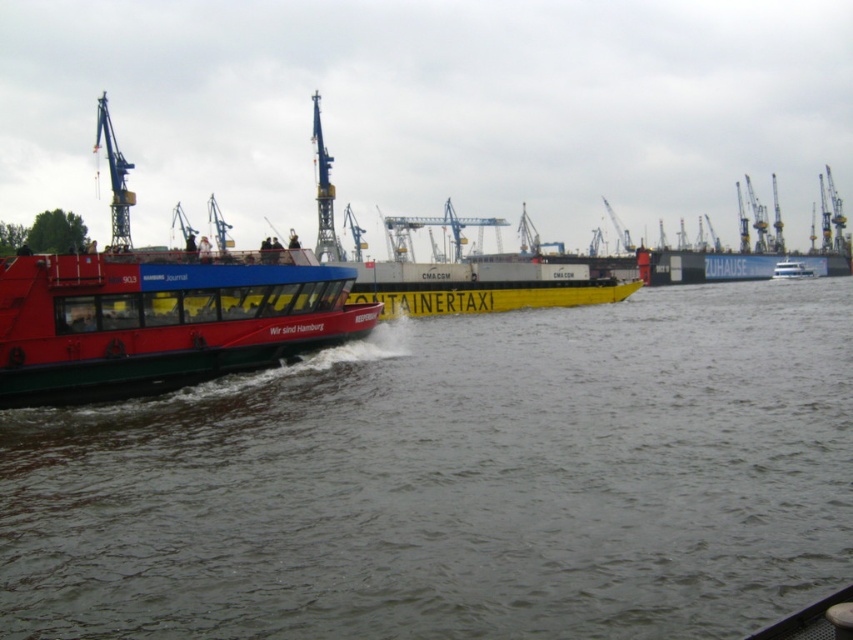
Does smooth water at center have a lesser height compared to yellow matte container taxi at center?

Indeed, smooth water at center has a lesser height compared to yellow matte container taxi at center.

Which is behind, point (254, 483) or point (807, 268)?

The point (807, 268) is behind.

Identify the location of smooth water at center. The image size is (853, 640). (457, 481).

Can you confirm if matte red ferry at left is positioned above yellow matte container taxi at center?

No, matte red ferry at left is not above yellow matte container taxi at center.

Is point (207, 332) more distant than point (809, 272)?

No, (207, 332) is closer to viewer.

Image resolution: width=853 pixels, height=640 pixels. What are the coordinates of `matte red ferry at left` in the screenshot? It's located at (161, 320).

Is point (131, 524) in front of point (90, 300)?

That is True.

In order to click on smooth water at center in this screenshot , I will do `click(457, 481)`.